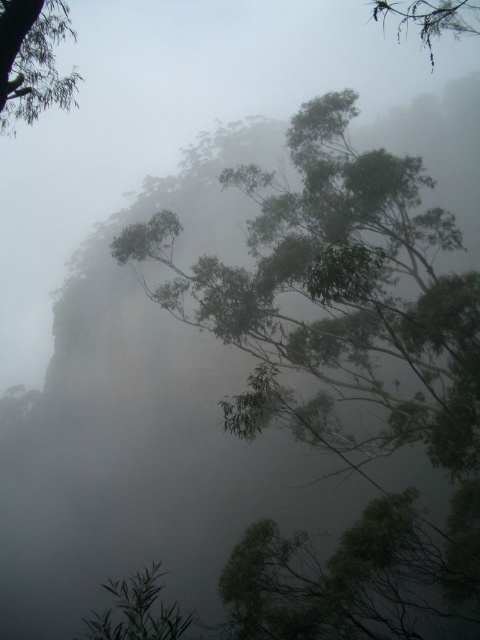
Question: Does green leafy tree at upper left appear under green leafy tree at upper right?

Choices:
 (A) no
 (B) yes

Answer: (B)

Question: Estimate the real-world distances between objects in this image. Which object is closer to the green leafy tree at lower left?

Choices:
 (A) green leafy tree at upper left
 (B) green leafy tree at upper right

Answer: (A)

Question: Can you confirm if green leafy tree at upper left is thinner than green leafy tree at lower left?

Choices:
 (A) yes
 (B) no

Answer: (B)

Question: Does green leafy tree at upper left have a lesser width compared to green leafy tree at upper right?

Choices:
 (A) yes
 (B) no

Answer: (A)

Question: Which object is the farthest from the green leafy tree at lower left?

Choices:
 (A) green leafy tree at upper right
 (B) green leafy tree at upper left

Answer: (A)

Question: Which is nearer to the green leafy tree at upper left?

Choices:
 (A) green leafy tree at upper right
 (B) green leafy tree at lower left

Answer: (B)